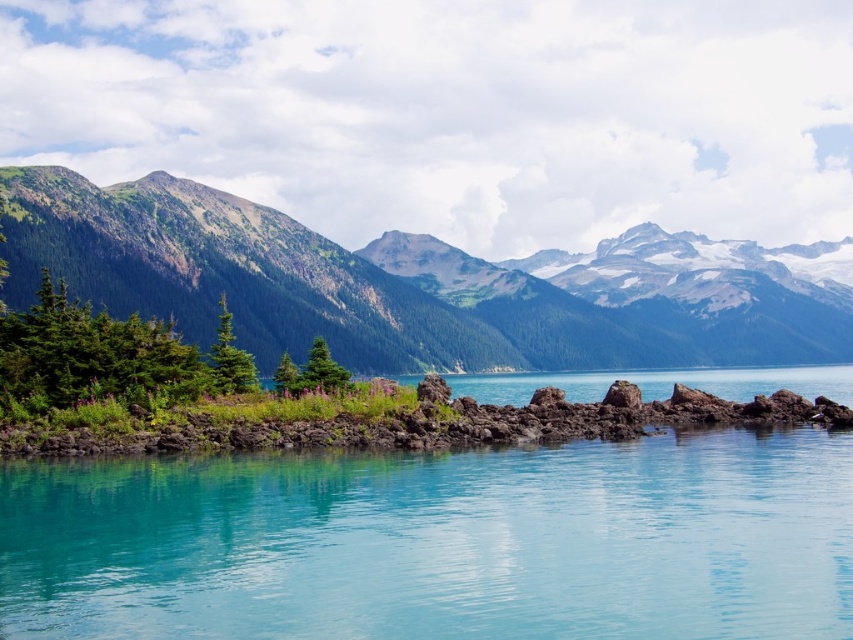
Question: Observing the image, what is the correct spatial positioning of turquoise glossy water at center in reference to green rocky mountain at left?

Choices:
 (A) above
 (B) below

Answer: (B)

Question: Which object is farther from the camera taking this photo?

Choices:
 (A) turquoise glossy water at center
 (B) green rocky mountain at left

Answer: (B)

Question: Which of the following is the closest to the observer?

Choices:
 (A) turquoise glossy water at center
 (B) green rocky mountain at left

Answer: (A)

Question: Is turquoise glossy water at center further to camera compared to green rocky mountain at left?

Choices:
 (A) yes
 (B) no

Answer: (B)

Question: Which point is farther from the camera taking this photo?

Choices:
 (A) coord(387,582)
 (B) coord(492,308)

Answer: (B)

Question: Does turquoise glossy water at center have a smaller size compared to green rocky mountain at left?

Choices:
 (A) no
 (B) yes

Answer: (B)